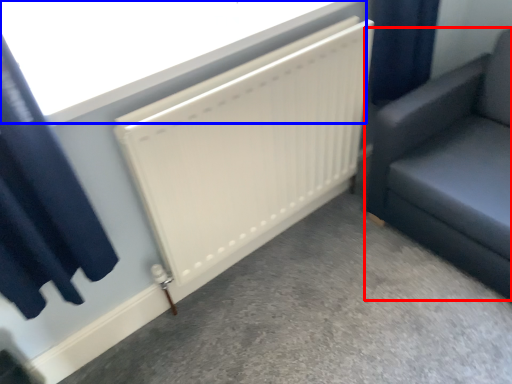
Question: Which point is further to the camera, furniture (highlighted by a red box) or window screen (highlighted by a blue box)?

Choices:
 (A) furniture
 (B) window screen

Answer: (A)